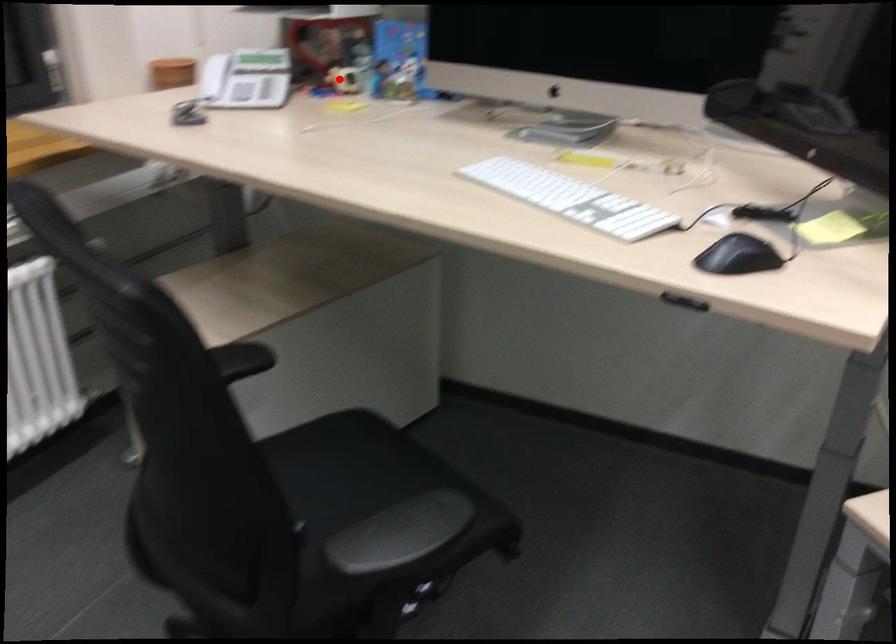
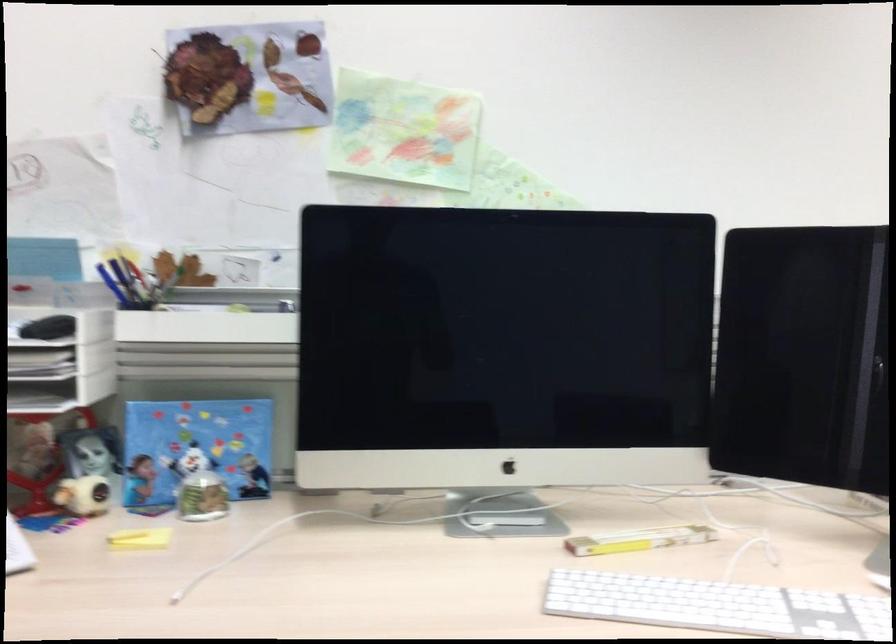
Question: A red point is marked in image1. In image2, is the corresponding 3D point closer to the camera or farther? Reply with the corresponding letter.

Choices:
 (A) The corresponding 3D point is closer.
 (B) The corresponding 3D point is farther.

Answer: (A)